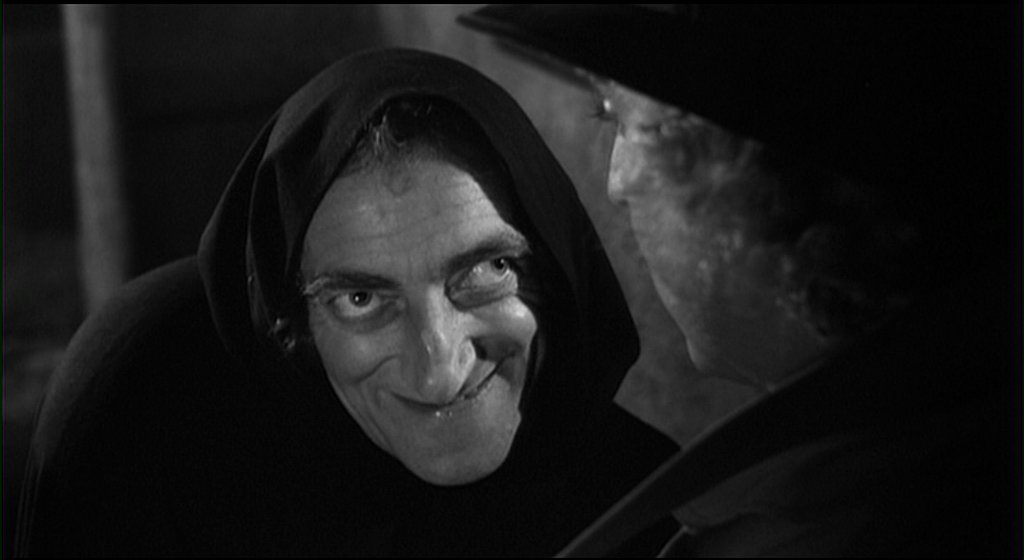
Image resolution: width=1024 pixels, height=560 pixels. I want to click on wall, so click(x=546, y=97).